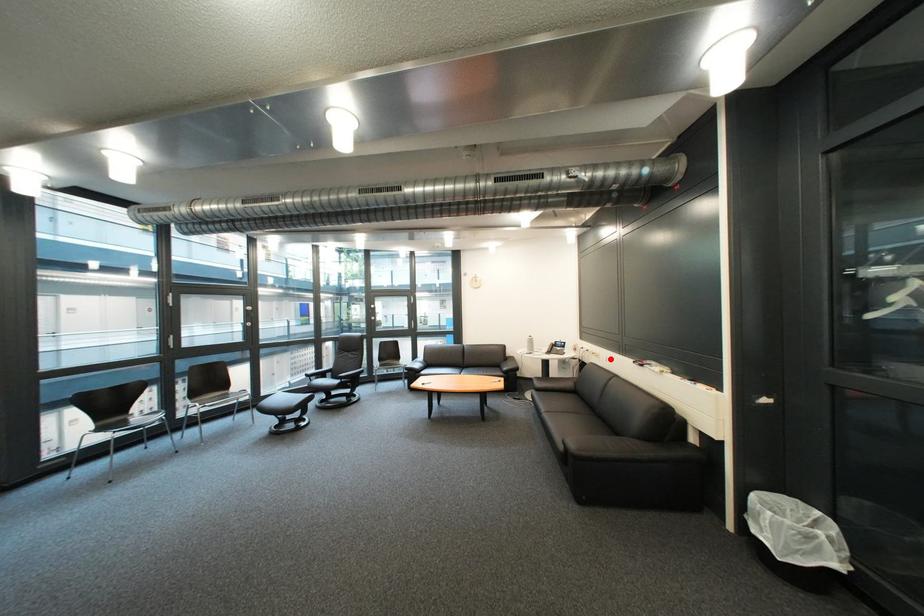
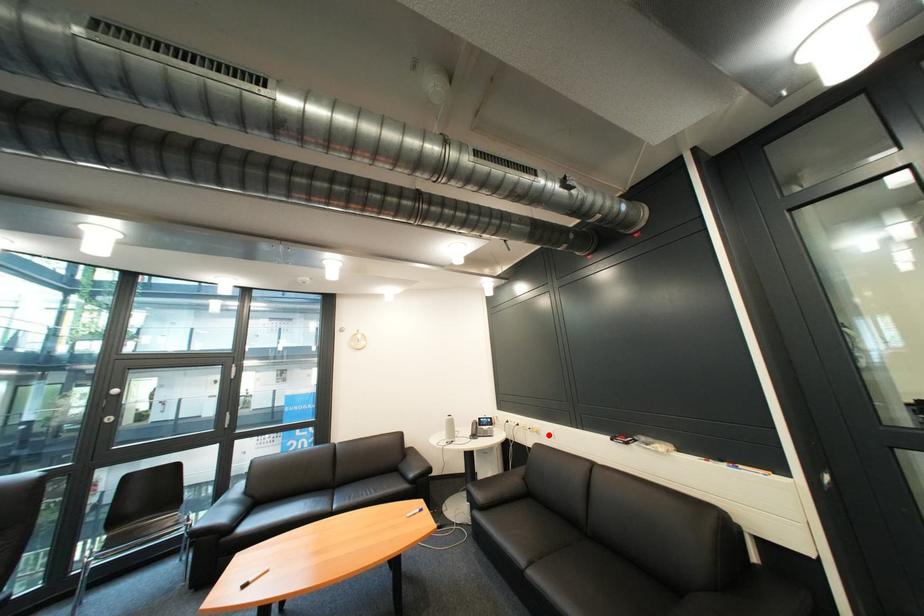
I am providing you with two images of the same scene from different viewpoints. A red point is marked on the first image and another point is marked on the second image. Is the red point in image1 aligned with the point shown in image2?

Yes